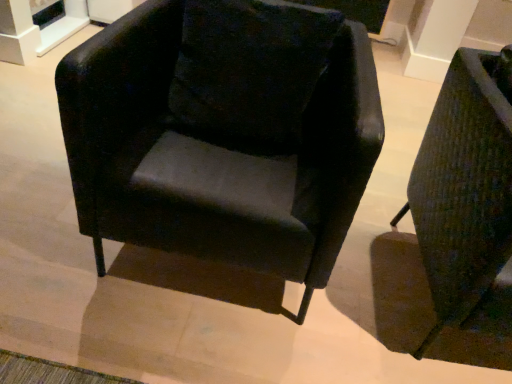
Question: Is velvet black pillow at center looking in the opposite direction of textured green fabric armchair at right, which is counted as the first chair, starting from the right?

Choices:
 (A) yes
 (B) no

Answer: (B)

Question: Are velvet black pillow at center and textured green fabric armchair at right, the 2th chair positioned from the left, far apart?

Choices:
 (A) yes
 (B) no

Answer: (B)

Question: Is velvet black pillow at center at the right side of textured green fabric armchair at right, the 2th chair positioned from the left?

Choices:
 (A) no
 (B) yes

Answer: (A)

Question: Is velvet black pillow at center next to textured green fabric armchair at right, the 2th chair positioned from the left?

Choices:
 (A) no
 (B) yes

Answer: (A)

Question: Does velvet black pillow at center have a greater height compared to textured green fabric armchair at right, which is counted as the first chair, starting from the right?

Choices:
 (A) yes
 (B) no

Answer: (B)

Question: Considering the positions of textured green fabric armchair at right, which is counted as the first chair, starting from the right, and velvet black pillow at center in the image, is textured green fabric armchair at right, which is counted as the first chair, starting from the right, taller or shorter than velvet black pillow at center?

Choices:
 (A) short
 (B) tall

Answer: (B)

Question: Is textured green fabric armchair at right, which is counted as the first chair, starting from the right, spatially inside velvet black pillow at center, or outside of it?

Choices:
 (A) outside
 (B) inside

Answer: (A)

Question: From the image's perspective, is textured green fabric armchair at right, the 2th chair positioned from the left, located above or below velvet black pillow at center?

Choices:
 (A) below
 (B) above

Answer: (A)

Question: Looking at their shapes, would you say textured green fabric armchair at right, the 2th chair positioned from the left, is wider or thinner than velvet black pillow at center?

Choices:
 (A) wide
 (B) thin

Answer: (A)

Question: Is matte black armchair at center, arranged as the 1th chair when viewed from the left, taller or shorter than velvet black pillow at center?

Choices:
 (A) short
 (B) tall

Answer: (B)

Question: Is matte black armchair at center, arranged as the 1th chair when viewed from the left, wider or thinner than velvet black pillow at center?

Choices:
 (A) thin
 (B) wide

Answer: (B)

Question: From a real-world perspective, is matte black armchair at center, arranged as the 1th chair when viewed from the left, physically located above or below velvet black pillow at center?

Choices:
 (A) below
 (B) above

Answer: (A)

Question: Do you think matte black armchair at center, positioned as the 2th chair in right-to-left order, is within velvet black pillow at center, or outside of it?

Choices:
 (A) inside
 (B) outside

Answer: (B)

Question: From the image's perspective, is matte black armchair at center, positioned as the 2th chair in right-to-left order, above or below textured green fabric armchair at right, which is counted as the first chair, starting from the right?

Choices:
 (A) below
 (B) above

Answer: (B)

Question: Based on their sizes in the image, would you say matte black armchair at center, positioned as the 2th chair in right-to-left order, is bigger or smaller than textured green fabric armchair at right, which is counted as the first chair, starting from the right?

Choices:
 (A) small
 (B) big

Answer: (B)